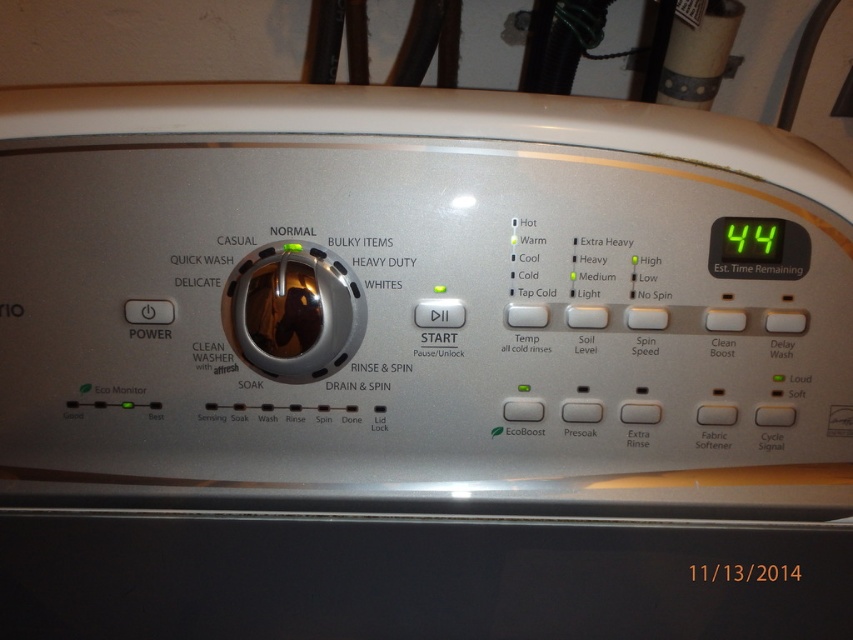
Question: Which of the following is the closest to the observer?

Choices:
 (A) satin silver knob at center
 (B) green digital display at upper right

Answer: (A)

Question: Is the position of satin silver knob at center less distant than that of green digital display at upper right?

Choices:
 (A) no
 (B) yes

Answer: (B)

Question: Is satin silver knob at center closer to camera compared to green digital display at upper right?

Choices:
 (A) yes
 (B) no

Answer: (A)

Question: Can you confirm if satin silver knob at center is wider than green digital display at upper right?

Choices:
 (A) no
 (B) yes

Answer: (B)